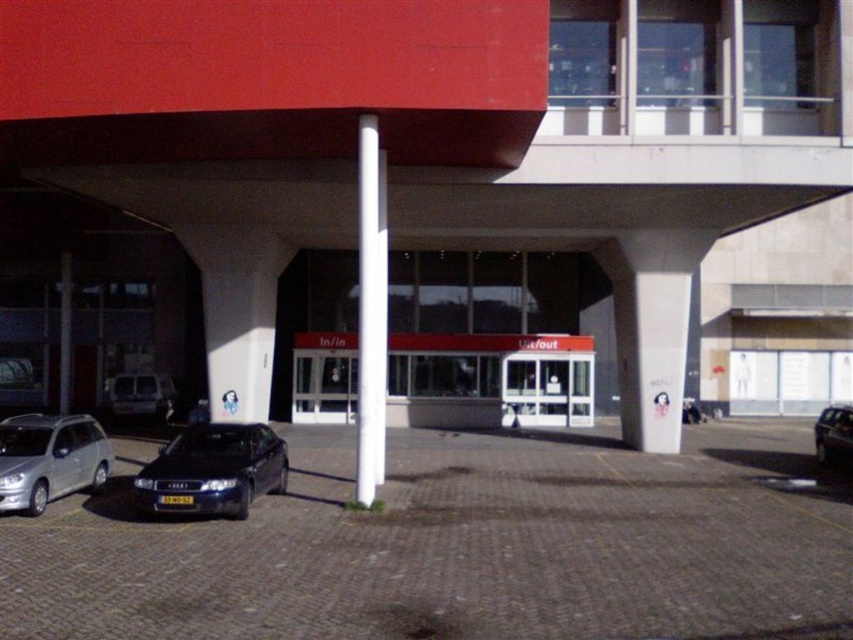
You are a delivery driver approaching the entrance of the matte red parking garage at center. You see the silver metallic hatchback at lower left parked nearby. Can you drive your truck, which is 2.5 meters tall, under the garage without hitting the structure?

The matte red parking garage at center is located above the silver metallic hatchback at lower left, which means there is clearance between them. However, the exact height isn not specified, so it is uncertain if the truck can pass safely. Check the height restrictions or measure the space before proceeding.

You are standing at the entrance of the modern building with a red facade and need to reach a specific point marked at coordinates point [718,621]. Given that the distance between you and this point is 24.87 feet, can you estimate how far you need to walk to reach it?

The distance between you and the point [718,621] is 24.87 feet, so you need to walk approximately 24.87 feet to reach it.